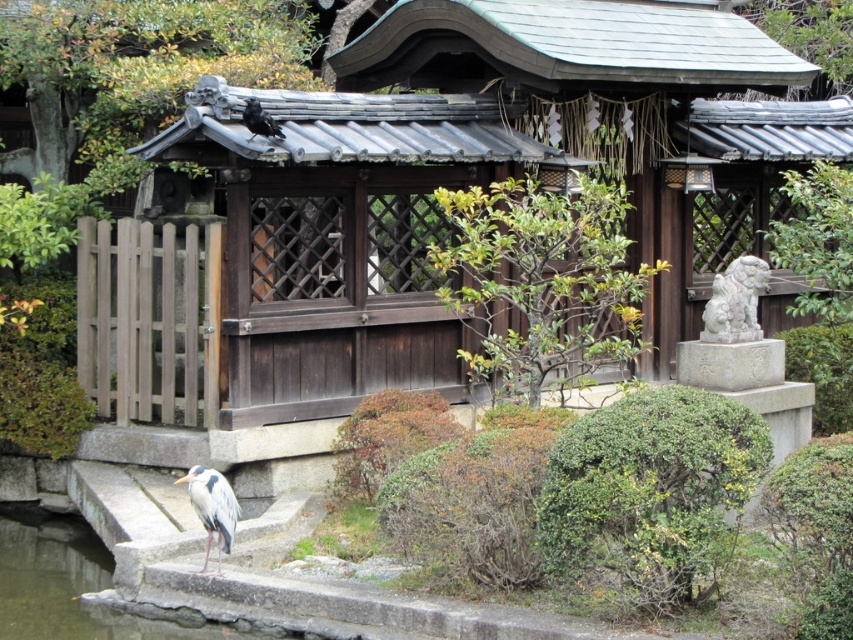
Question: Among these objects, which one is farthest from the camera?

Choices:
 (A) white stone lion at right
 (B) gray feathered heron at lower left
 (C) shiny black crow at upper center

Answer: (A)

Question: Is gray feathered heron at lower left above shiny black crow at upper center?

Choices:
 (A) no
 (B) yes

Answer: (A)

Question: Which point is closer to the camera taking this photo?

Choices:
 (A) (195, 508)
 (B) (734, 288)

Answer: (A)

Question: Can you confirm if white stone lion at right is wider than shiny black crow at upper center?

Choices:
 (A) yes
 (B) no

Answer: (A)

Question: Observing the image, what is the correct spatial positioning of white stone lion at right in reference to shiny black crow at upper center?

Choices:
 (A) below
 (B) above

Answer: (A)

Question: Considering the real-world distances, which object is farthest from the white stone lion at right?

Choices:
 (A) gray feathered heron at lower left
 (B) shiny black crow at upper center

Answer: (A)